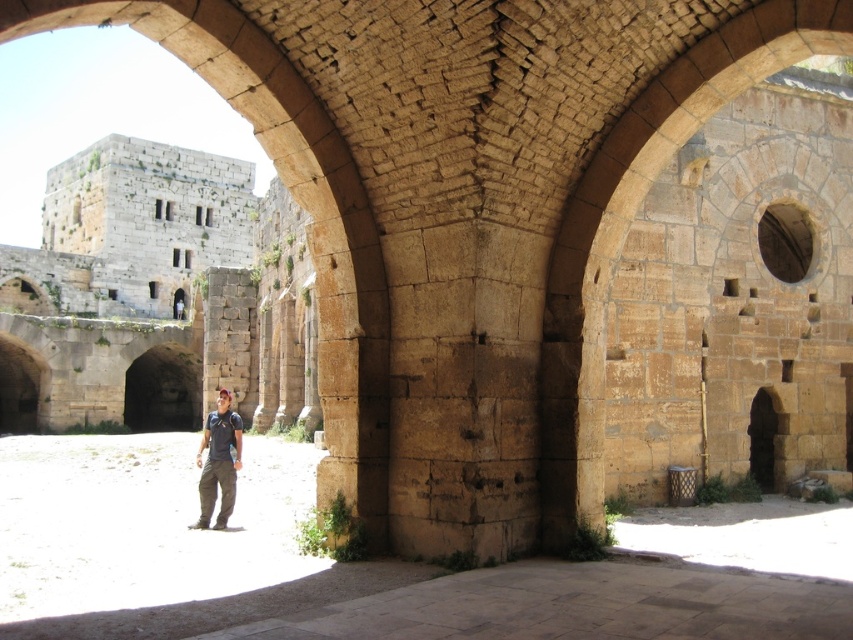
You are standing inside the ancient stone structure and want to take a photo. You notice two points marked in the scene. Which point, point (735, 564) or point (233, 422), is closer to your current position?

Point (735, 564) is closer to the camera than point (233, 422), so it is closer to your current position.

From the picture: You are standing at point (368, 563) in the ancient stone structure. What is the name of the feature located at your current position?

The feature at point (368, 563) is the brown stone courtyard at center.